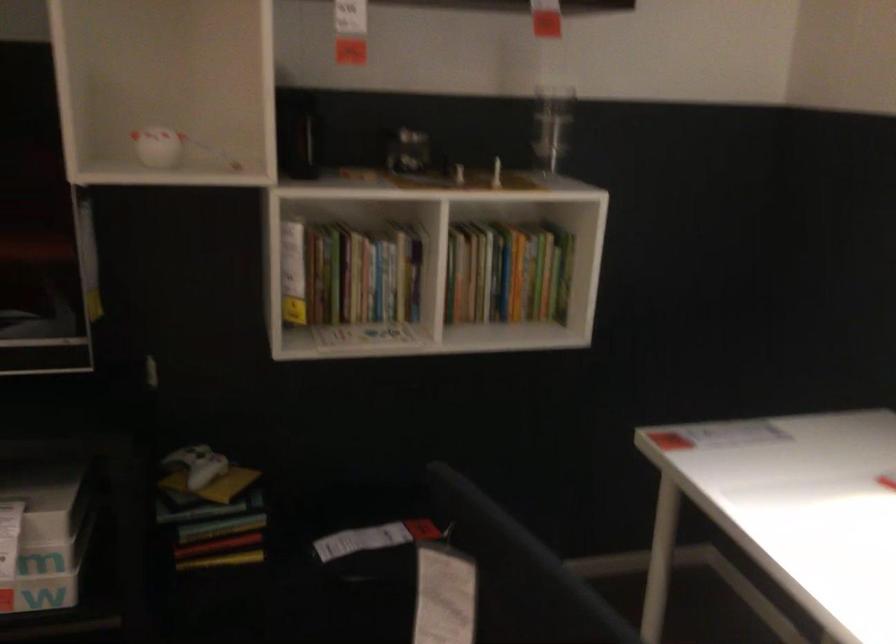
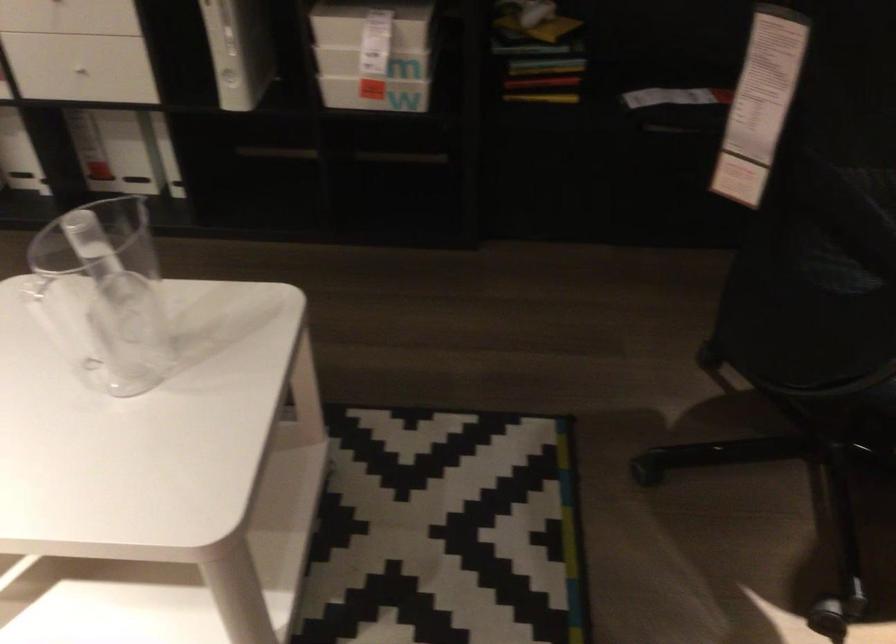
The first image is from the beginning of the video and the second image is from the end. How did the camera likely rotate when shooting the video?

The camera rotated toward left-down.